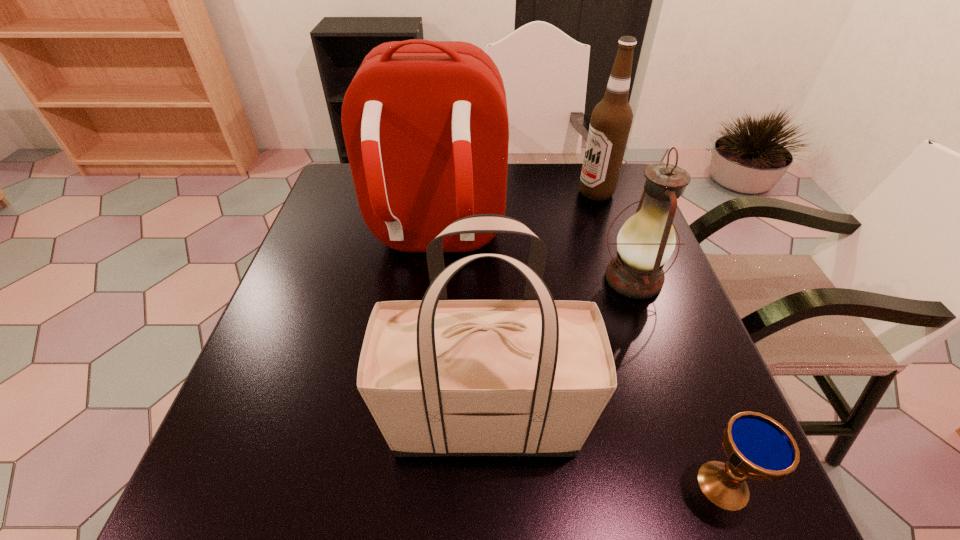
I want to click on oil lamp located in the right edge section of the desktop, so click(646, 241).

Where is `chalice that is positioned at the right edge`? The image size is (960, 540). chalice that is positioned at the right edge is located at coordinates (758, 447).

Find the location of a particular element. object at the far left corner is located at coordinates (425, 123).

The height and width of the screenshot is (540, 960). Identify the location of object at the far right corner. (611, 119).

Where is `object present at the near right corner`? This screenshot has height=540, width=960. object present at the near right corner is located at coordinates (758, 447).

Find the location of `free space at the far edge of the desktop`. free space at the far edge of the desktop is located at coordinates (559, 197).

Where is `free space at the near edge of the desktop`? free space at the near edge of the desktop is located at coordinates (553, 518).

I want to click on vacant space at the left edge of the desktop, so click(321, 237).

Where is `vacant region at the right edge of the desktop`? The image size is (960, 540). vacant region at the right edge of the desktop is located at coordinates click(617, 301).

Locate an element on the screen. free space between the fourth tallest object and the alcohol is located at coordinates (614, 236).